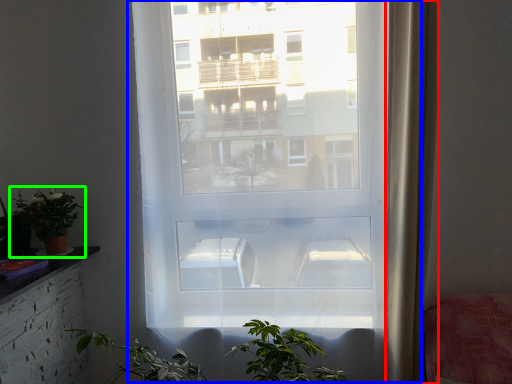
Question: Based on their relative distances, which object is farther from curtain (highlighted by a red box)? Choose from window (highlighted by a blue box) and houseplant (highlighted by a green box).

Choices:
 (A) window
 (B) houseplant

Answer: (B)